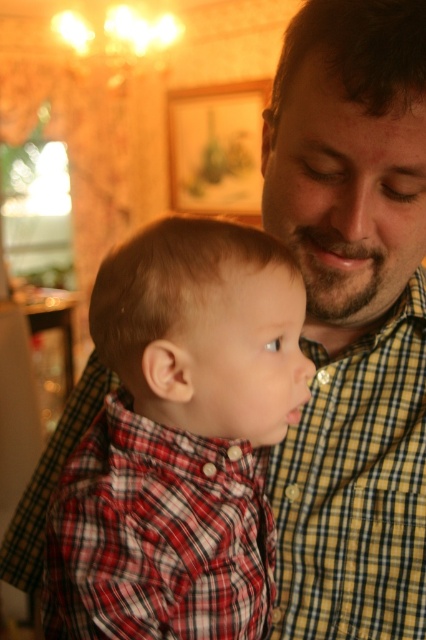
Does red plaid shirt at center appear on the right side of yellow checkered shirt at center?

Incorrect, red plaid shirt at center is not on the right side of yellow checkered shirt at center.

Is red plaid shirt at center bigger than yellow checkered shirt at center?

Indeed, red plaid shirt at center has a larger size compared to yellow checkered shirt at center.

What do you see at coordinates (180, 440) in the screenshot?
I see `red plaid shirt at center` at bounding box center [180, 440].

Identify the location of red plaid shirt at center. The image size is (426, 640). (180, 440).